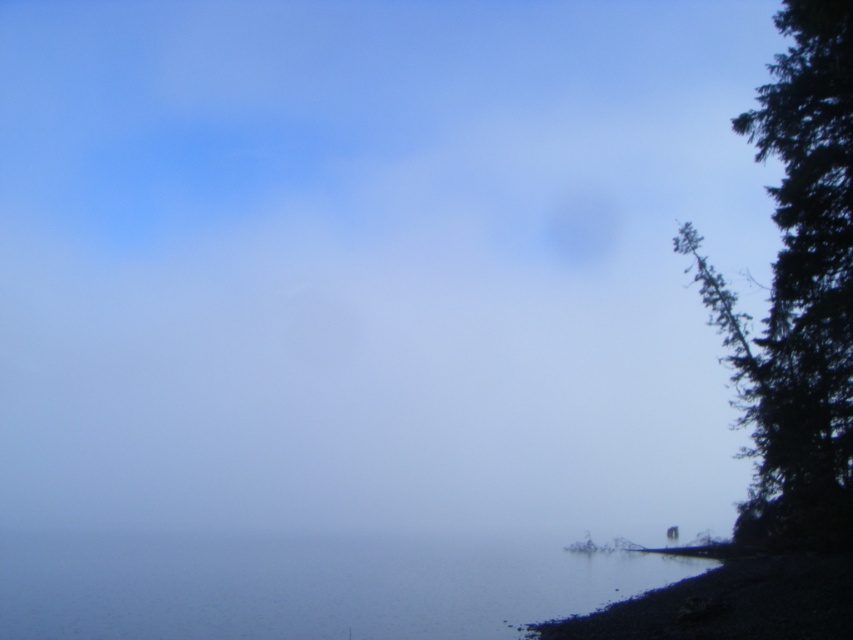
You are standing on the lakeside path and see the clear water at lower right and the dark green textured tree at right. Which object is closer to your feet?

The clear water at lower right is closer to your feet because it is located below the dark green textured tree at right, meaning it is positioned lower in the scene.

You are standing at the point marked as point (x=306, y=586) in the image. Based on the scene description, what type of surface are you currently standing on?

The point (x=306, y=586) is on clear water at lower right, so you are standing on clear water.

Looking at this image, you are standing at the lakeside and want to cross to the other side. The clear water at lower right is your path. Considering the dark green textured tree at right is blocking part of the view, can you estimate if the water is wide enough to cross?

The clear water at lower right might be wider than dark green textured tree at right, so it is possible that the water is wide enough to cross, but the tree partially obscures the view making it uncertain.